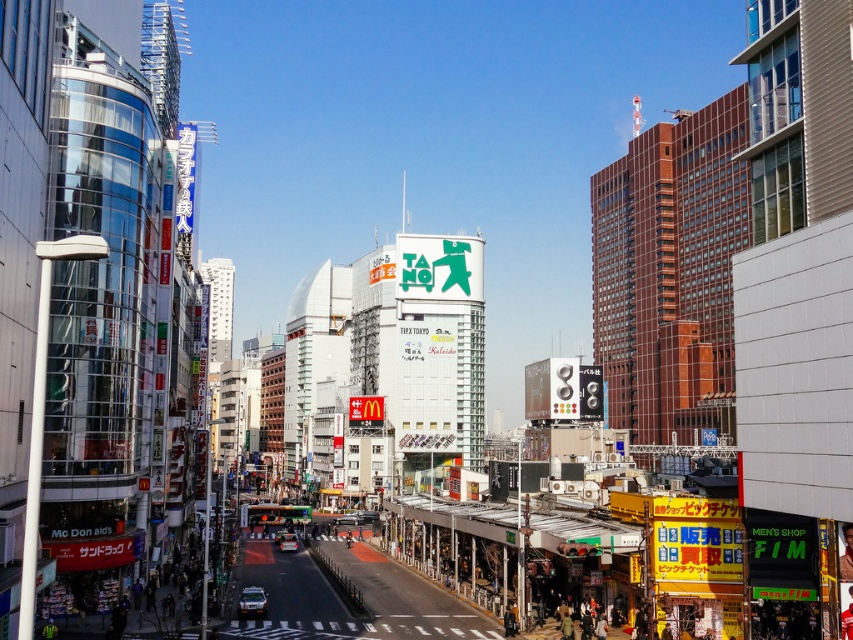
You are a delivery person trying to park your shiny silver car at center and silver metallic car at center in a narrow alley. Which car should you choose to park first to ensure both can fit?

The shiny silver car at center has a lesser height compared to the silver metallic car at center, so you should park the shiny silver car at center first to ensure both can fit in the narrow alley.

You are a delivery driver who needs to park your car at the parking spot located at point (x=252, y=602). However, there is a silver metallic car at lower left. Can you park your car there?

The parking spot at point (x=252, y=602) is occupied by a silver metallic car at lower left, so you cannot park there.